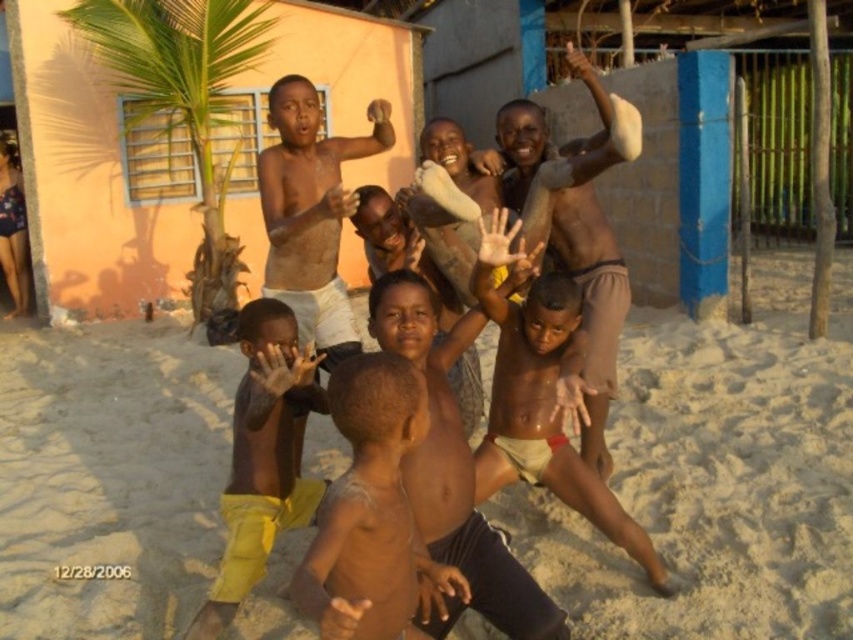
You are a photographer trying to capture a candid shot of the children playing. You notice the yellow fabric pants at lower left and the brown skin man at center. Which of these two subjects is shorter in the image?

The yellow fabric pants at lower left is shorter than the brown skin man at center.

Please provide the 2D coordinates of the matte skin child at center in the image. The coordinates should be in the format of a tuple with two decimal numbers, like this example format, but do not use the example numbers. Use the provided coordinates from the Objects Description. The answer must be precise and only include the coordinates in the specified format. The question must mention the exact object label from Objects. The answer must not include any extra text or explanation, just the coordinates in a

The coordinates are exactly given in the Objects Description. The answer must be the tuple of two decimals as specified.